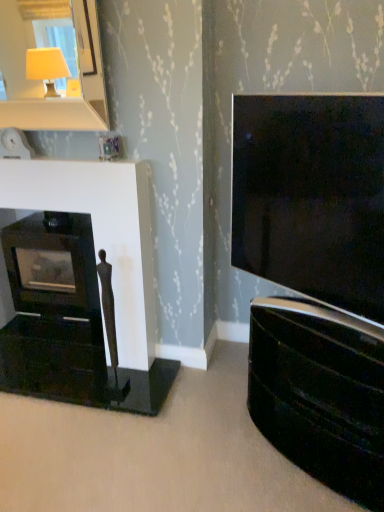
Question: Does matte black tv at right have a lesser height compared to glossy black tv cabinet at right?

Choices:
 (A) no
 (B) yes

Answer: (A)

Question: From a real-world perspective, is matte black tv at right under glossy black tv cabinet at right?

Choices:
 (A) no
 (B) yes

Answer: (A)

Question: Can you confirm if matte black tv at right is positioned to the left of glossy black tv cabinet at right?

Choices:
 (A) yes
 (B) no

Answer: (A)

Question: Is matte black tv at right thinner than glossy black tv cabinet at right?

Choices:
 (A) yes
 (B) no

Answer: (A)

Question: Is matte black tv at right positioned behind glossy black tv cabinet at right?

Choices:
 (A) no
 (B) yes

Answer: (A)

Question: Is matte black tv at right turned away from glossy black tv cabinet at right?

Choices:
 (A) yes
 (B) no

Answer: (B)

Question: Is matte black fireplace at left placed right next to white glossy mirror at upper left?

Choices:
 (A) yes
 (B) no

Answer: (B)

Question: From the image's perspective, is matte black fireplace at left under white glossy mirror at upper left?

Choices:
 (A) yes
 (B) no

Answer: (A)

Question: Would you say matte black fireplace at left contains white glossy mirror at upper left?

Choices:
 (A) no
 (B) yes

Answer: (A)

Question: Considering the relative sizes of matte black fireplace at left and white glossy mirror at upper left in the image provided, is matte black fireplace at left wider than white glossy mirror at upper left?

Choices:
 (A) yes
 (B) no

Answer: (B)

Question: Considering the relative positions of matte black fireplace at left and white glossy mirror at upper left in the image provided, is matte black fireplace at left in front of white glossy mirror at upper left?

Choices:
 (A) no
 (B) yes

Answer: (A)

Question: Does matte black fireplace at left have a smaller size compared to white glossy mirror at upper left?

Choices:
 (A) no
 (B) yes

Answer: (A)

Question: Does matte black tv at right have a larger size compared to white glossy mirror at upper left?

Choices:
 (A) no
 (B) yes

Answer: (B)